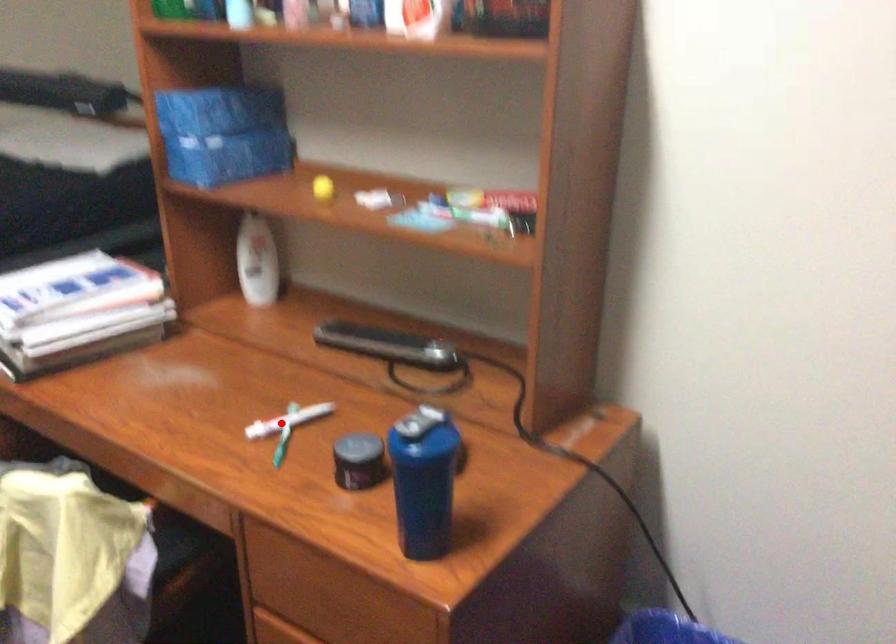
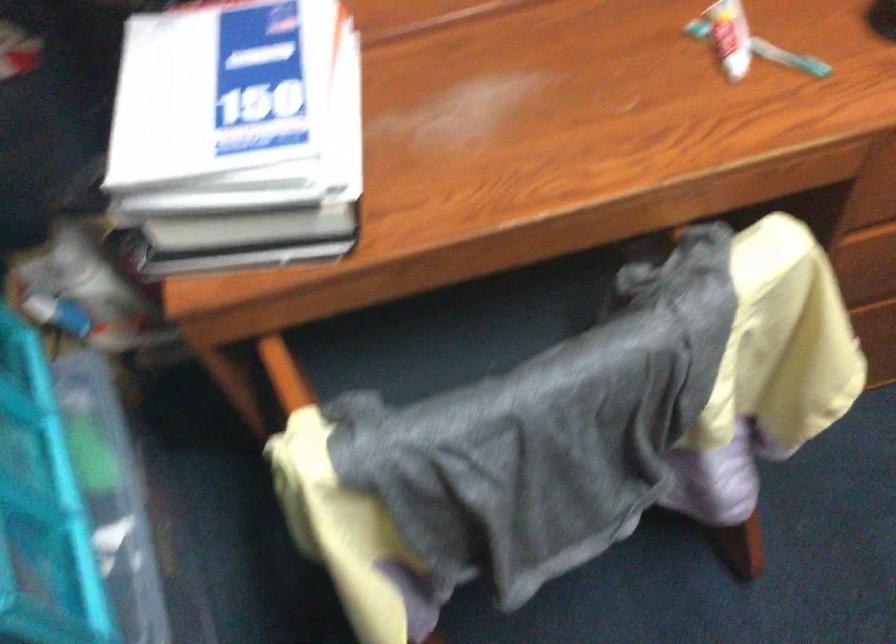
In the second image, find the point that corresponds to the highlighted location in the first image.

(730, 37)